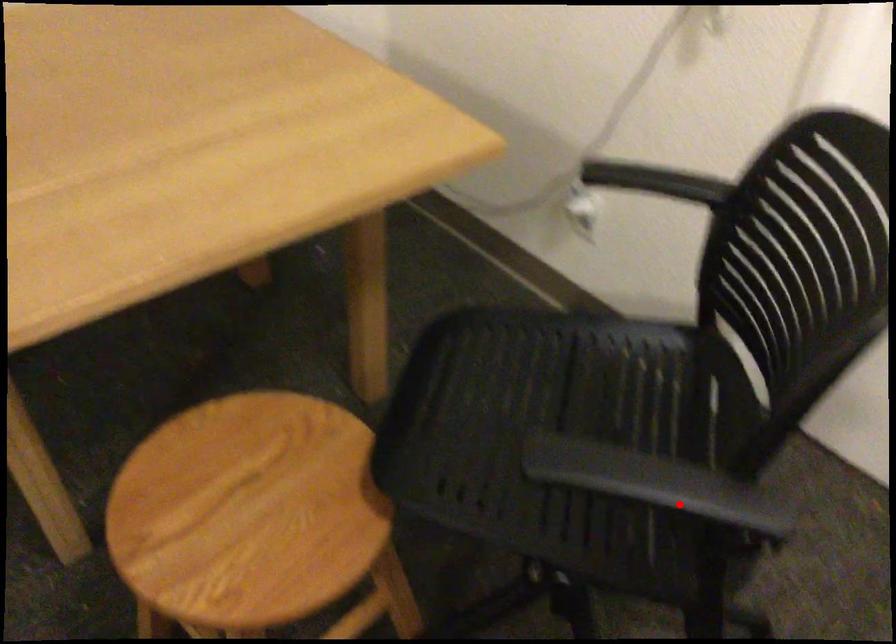
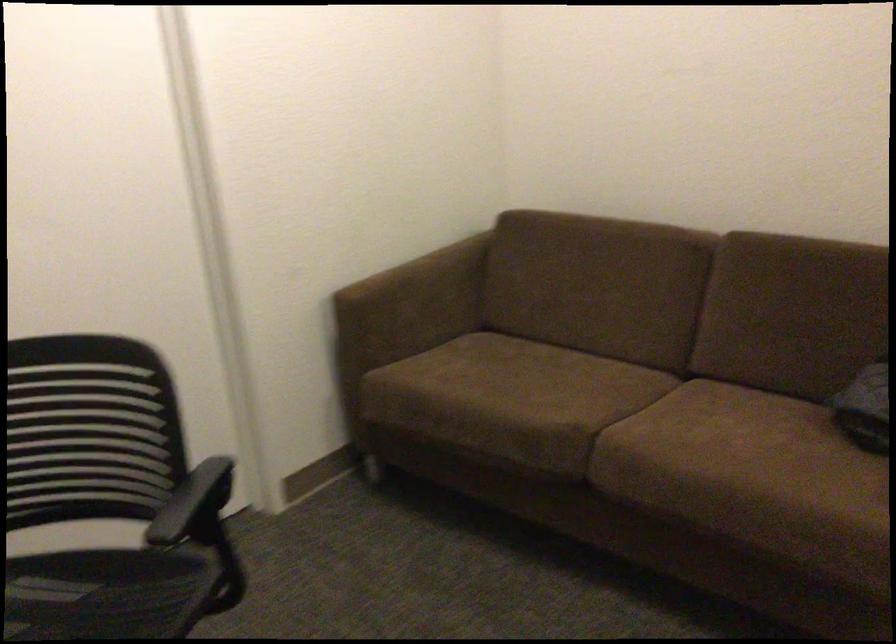
Question: I am providing you with two images of the same scene from different viewpoints. In image1, a red point is highlighted. Considering the same 3D point in image2, which of the following is correct?

Choices:
 (A) It is closer
 (B) It is farther

Answer: (B)